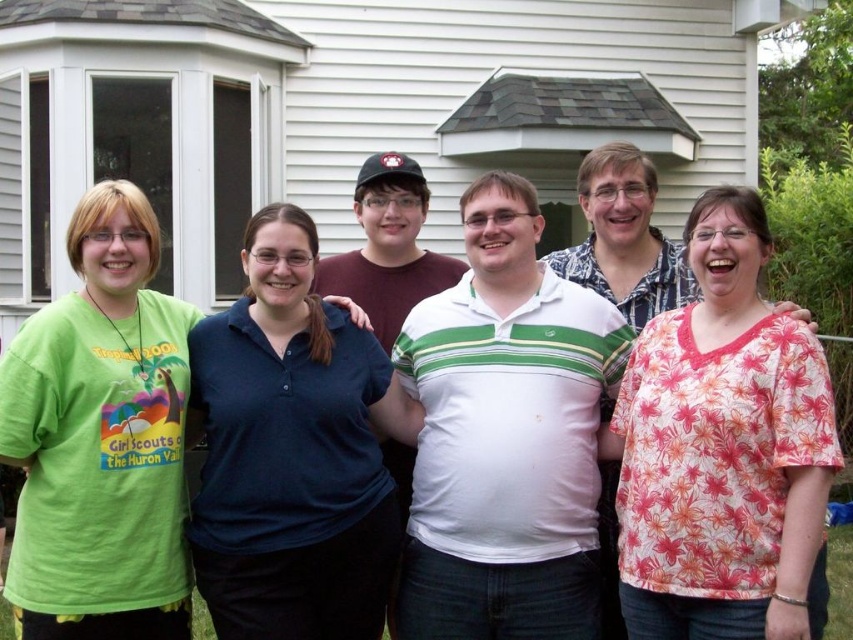
Question: Is floral print blouse at center positioned behind green cotton t-shirt at left?

Choices:
 (A) yes
 (B) no

Answer: (B)

Question: Which of the following is the farthest from the observer?

Choices:
 (A) green cotton t-shirt at left
 (B) floral print blouse at center
 (C) dark blue polo shirt at center

Answer: (C)

Question: Does floral print blouse at center have a larger size compared to dark blue polo shirt at center?

Choices:
 (A) no
 (B) yes

Answer: (A)

Question: Which object is positioned closest to the dark blue polo shirt at center?

Choices:
 (A) floral print blouse at center
 (B) green cotton t-shirt at left

Answer: (B)

Question: Is dark blue polo shirt at center below green cotton t-shirt at left?

Choices:
 (A) yes
 (B) no

Answer: (A)

Question: Which point appears closest to the camera in this image?

Choices:
 (A) (780, 545)
 (B) (248, 417)

Answer: (A)